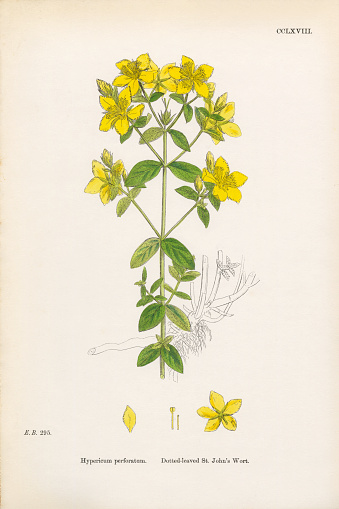
The height and width of the screenshot is (509, 339). Find the location of `the bottom of plant`. the bottom of plant is located at coordinates point(161,374).